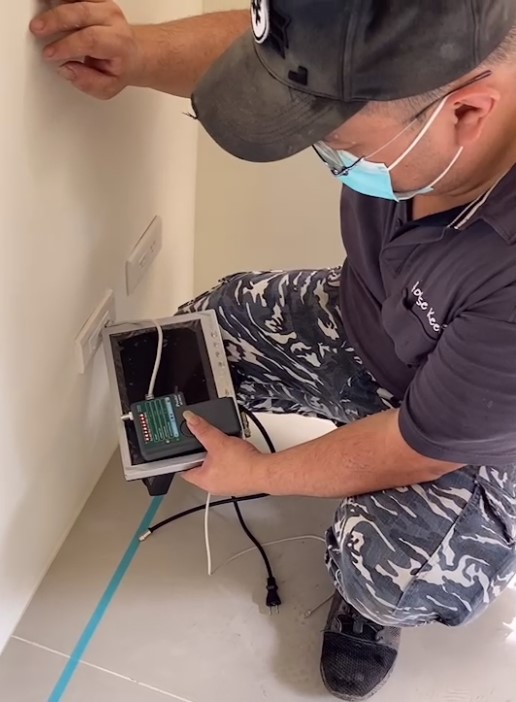
Identify the location of white sheetrock walls. Image resolution: width=516 pixels, height=702 pixels. (52, 246), (268, 217).